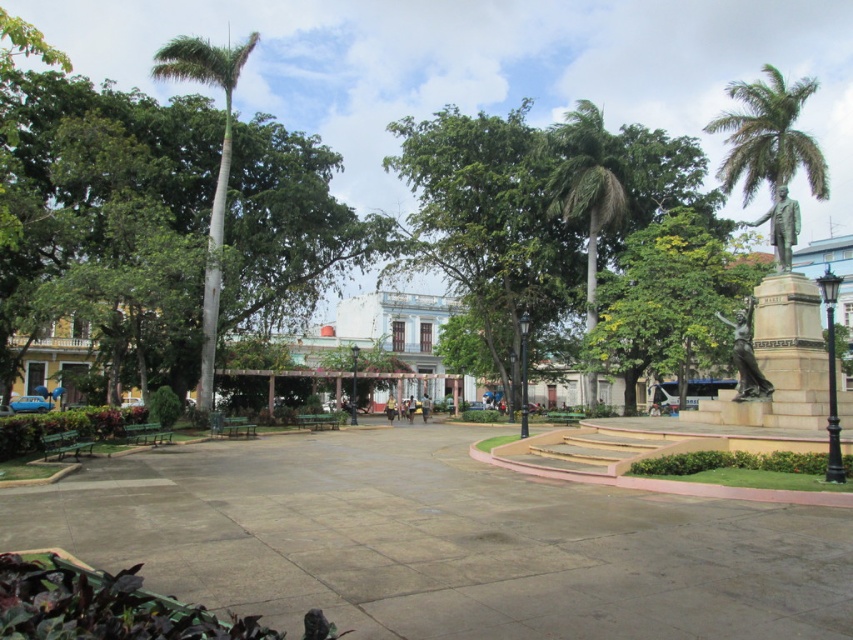
Question: Which object is farther from the camera taking this photo?

Choices:
 (A) green smooth palm tree at left
 (B) green leafy palm tree at upper right

Answer: (B)

Question: Estimate the real-world distances between objects in this image. Which object is closer to the concrete at center?

Choices:
 (A) green smooth palm tree at left
 (B) green leafy palm tree at center
 (C) green leafy palm tree at upper right

Answer: (A)

Question: Does concrete at center appear on the right side of green smooth palm tree at left?

Choices:
 (A) yes
 (B) no

Answer: (A)

Question: Which point is farther to the camera?

Choices:
 (A) (819, 182)
 (B) (584, 209)
 (C) (206, 339)

Answer: (B)

Question: Can you confirm if concrete at center is positioned to the right of green leafy palm tree at upper right?

Choices:
 (A) no
 (B) yes

Answer: (A)

Question: Is concrete at center to the left of green leafy palm tree at center from the viewer's perspective?

Choices:
 (A) yes
 (B) no

Answer: (A)